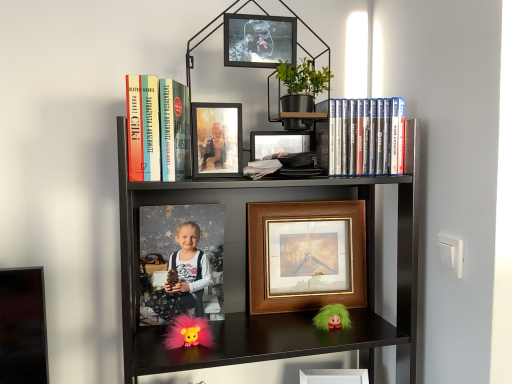
Question: Is metallic photo frame at upper center, the 1th picture frame from the front, outside fuzzy pink doll at lower center?

Choices:
 (A) no
 (B) yes

Answer: (B)

Question: Is fuzzy pink doll at lower center located within metallic photo frame at upper center, which is the 4th picture frame in back-to-front order?

Choices:
 (A) yes
 (B) no

Answer: (B)

Question: Is metallic photo frame at upper center, which is the first picture frame in top-to-bottom order, closer to camera compared to fuzzy pink doll at lower center?

Choices:
 (A) yes
 (B) no

Answer: (A)

Question: Is metallic photo frame at upper center, the 4th picture frame in the bottom-to-top sequence, at the left side of fuzzy pink doll at lower center?

Choices:
 (A) yes
 (B) no

Answer: (B)

Question: Can you confirm if metallic photo frame at upper center, which is the first picture frame in top-to-bottom order, is wider than fuzzy pink doll at lower center?

Choices:
 (A) yes
 (B) no

Answer: (B)

Question: Is matte black dress at center in front of or behind woodenobject at center, the 1th picture frame viewed from the back, in the image?

Choices:
 (A) front
 (B) behind

Answer: (A)

Question: Considering the positions of point pos(183,289) and point pos(271,309), is point pos(183,289) closer or farther from the camera than point pos(271,309)?

Choices:
 (A) farther
 (B) closer

Answer: (B)

Question: Looking at the image, does matte black dress at center seem bigger or smaller compared to woodenobject at center, the 3th picture frame from the top?

Choices:
 (A) small
 (B) big

Answer: (A)

Question: From their relative heights in the image, would you say matte black dress at center is taller or shorter than woodenobject at center, marked as the 2th picture frame in a bottom-to-top arrangement?

Choices:
 (A) short
 (B) tall

Answer: (A)

Question: Is matte plastic dvds at upper right, which is the first book in right-to-left order, spatially inside woodenobject at center, the 3th picture frame from the top, or outside of it?

Choices:
 (A) outside
 (B) inside

Answer: (A)

Question: Does point (367, 114) appear closer or farther from the camera than point (274, 205)?

Choices:
 (A) farther
 (B) closer

Answer: (B)

Question: Considering the positions of matte plastic dvds at upper right, which is the first book in right-to-left order, and woodenobject at center, the 3th picture frame from the top, in the image, is matte plastic dvds at upper right, which is the first book in right-to-left order, wider or thinner than woodenobject at center, the 3th picture frame from the top,?

Choices:
 (A) wide
 (B) thin

Answer: (B)

Question: Considering the positions of matte plastic dvds at upper right, which is the second book in left-to-right order, and woodenobject at center, the 1th picture frame viewed from the back, in the image, is matte plastic dvds at upper right, which is the second book in left-to-right order, taller or shorter than woodenobject at center, the 1th picture frame viewed from the back,?

Choices:
 (A) short
 (B) tall

Answer: (A)

Question: Is matte black dress at center in front of or behind black matte bookcase at upper center in the image?

Choices:
 (A) behind
 (B) front

Answer: (A)

Question: From the image's perspective, is matte black dress at center located above or below black matte bookcase at upper center?

Choices:
 (A) below
 (B) above

Answer: (B)